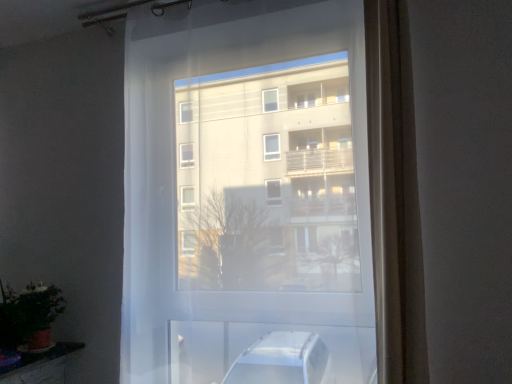
Question: Considering their positions, is satin beige curtain at right located in front of or behind green matte plant at lower left?

Choices:
 (A) front
 (B) behind

Answer: (A)

Question: Considering the positions of point (373, 148) and point (20, 317), is point (373, 148) closer or farther from the camera than point (20, 317)?

Choices:
 (A) farther
 (B) closer

Answer: (B)

Question: Which of these objects is positioned farthest from the green matte plant at lower left?

Choices:
 (A) transparent fabric at center
 (B) satin beige curtain at right

Answer: (B)

Question: Which object is positioned farthest from the transparent fabric at center?

Choices:
 (A) satin beige curtain at right
 (B) green matte plant at lower left

Answer: (B)